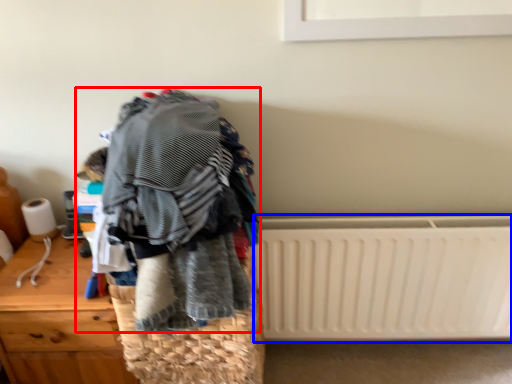
Question: Which object appears closest to the camera in this image, textile (highlighted by a red box) or radiator (highlighted by a blue box)?

Choices:
 (A) textile
 (B) radiator

Answer: (A)